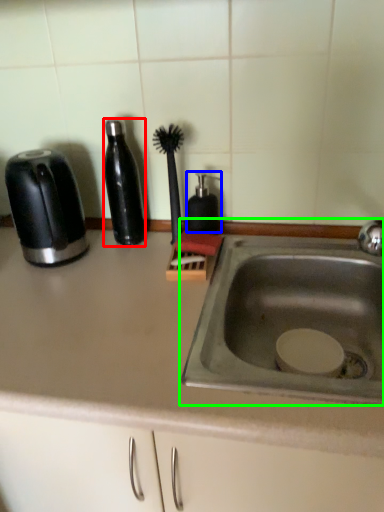
Question: Which object is positioned farthest from bottle (highlighted by a red box)? Select from soap dispenser (highlighted by a blue box) and sink (highlighted by a green box).

Choices:
 (A) soap dispenser
 (B) sink

Answer: (B)